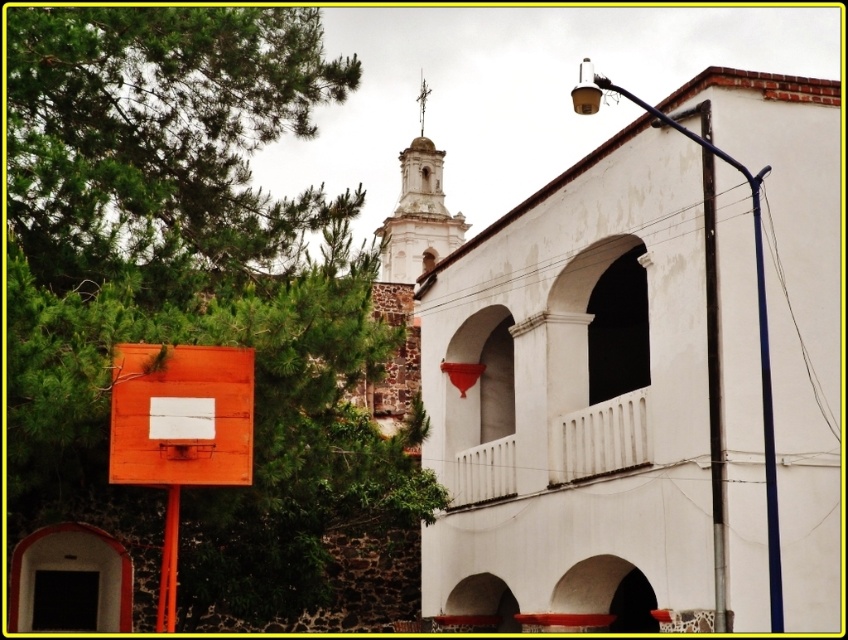
Question: Which of the following is the farthest from the observer?

Choices:
 (A) (132, 392)
 (B) (160, 211)

Answer: (B)

Question: Can you confirm if green leafy tree at upper left is thinner than orange matte basketball backboard at left?

Choices:
 (A) yes
 (B) no

Answer: (B)

Question: Can you confirm if green leafy tree at upper left is smaller than orange matte basketball backboard at left?

Choices:
 (A) no
 (B) yes

Answer: (A)

Question: Which of the following is the closest to the observer?

Choices:
 (A) (282, 515)
 (B) (148, 374)

Answer: (B)

Question: Observing the image, what is the correct spatial positioning of green leafy tree at upper left in reference to orange matte basketball backboard at left?

Choices:
 (A) left
 (B) right

Answer: (B)